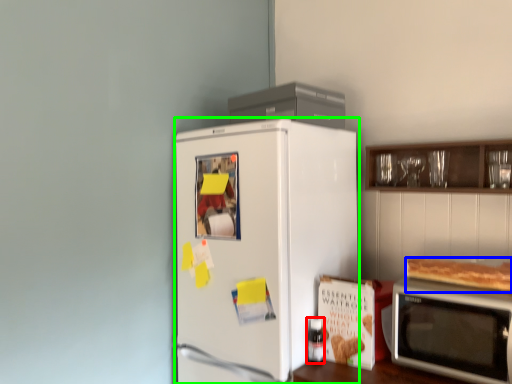
Question: Which is nearer to the bottle (highlighted by a red box)? food (highlighted by a blue box) or refrigerator (highlighted by a green box).

Choices:
 (A) food
 (B) refrigerator

Answer: (B)